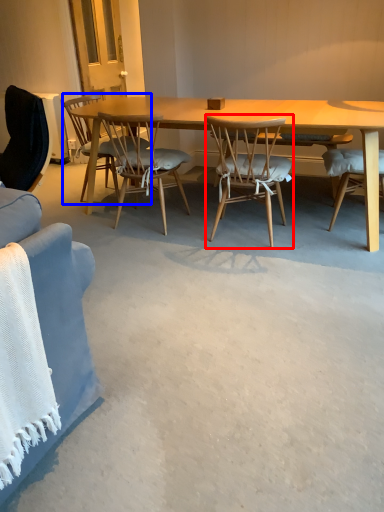
Question: Which object is closer to the camera taking this photo, chair (highlighted by a red box) or chair (highlighted by a blue box)?

Choices:
 (A) chair
 (B) chair

Answer: (A)